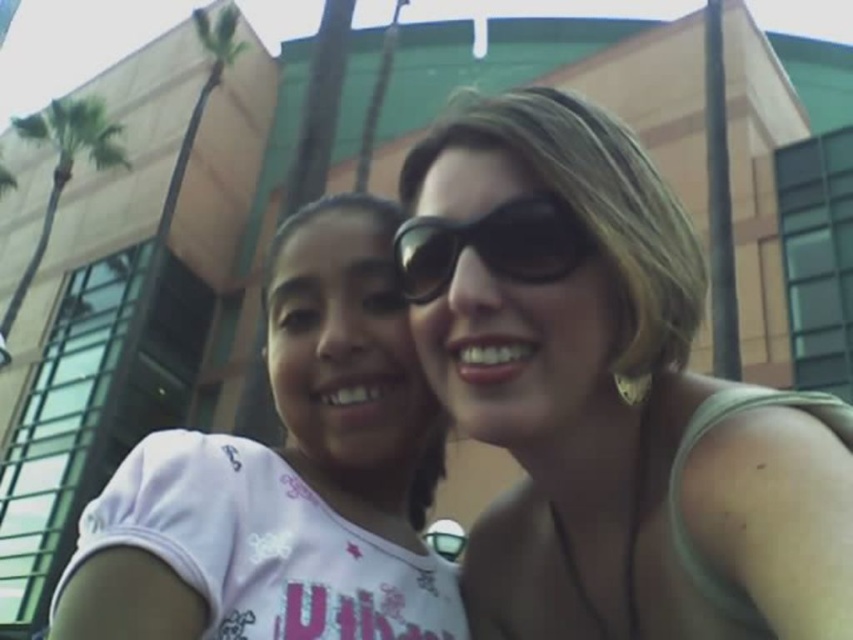
You are holding a selfie stick that extends to 30 inches. You want to take a photo of the black reflective sunglasses at center without moving the person wearing them. Can you reach the sunglasses with your selfie stick?

The black reflective sunglasses at center are 28.66 inches away from the viewer. Since the selfie stick extends to 30 inches, which is longer than the distance to the sunglasses, you can reach them without moving the person wearing them.

You are a photographer adjusting the focus on your camera. You need to ensure both the matte black sunglasses at upper center and the black reflective sunglasses at center are in focus. Given that the depth of field can cover objects within a 6 inch range, will both sunglasses be in focus?

The matte black sunglasses at upper center and the black reflective sunglasses at center are 6.27 inches apart from each other. Since the depth of field can only cover 6 inches, the distance between them exceeds this range, so both sunglasses cannot be in focus simultaneously.